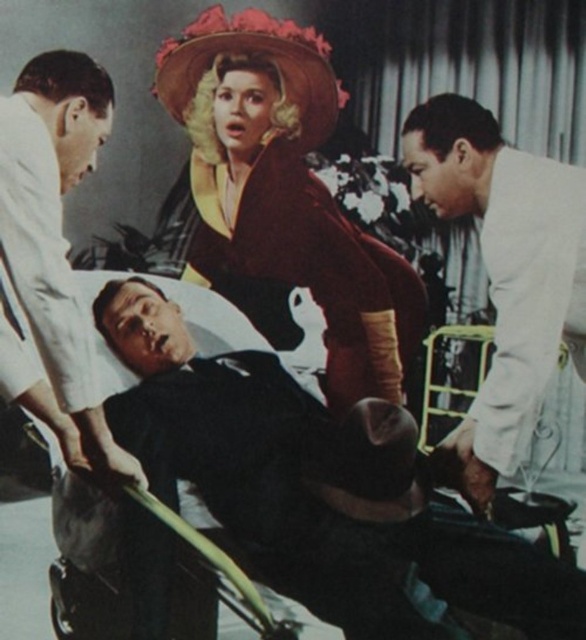
Question: Can you confirm if velvet maroon dress at center is positioned above white matte coat at right?

Choices:
 (A) no
 (B) yes

Answer: (B)

Question: Does velvet maroon dress at center have a smaller size compared to white matte coat at right?

Choices:
 (A) no
 (B) yes

Answer: (A)

Question: Observing the image, what is the correct spatial positioning of black matte suit at center in reference to white cloth coat at left?

Choices:
 (A) above
 (B) below

Answer: (B)

Question: Which object appears farthest from the camera in this image?

Choices:
 (A) white cloth coat at left
 (B) white matte coat at right

Answer: (B)

Question: Which object is closer to the camera taking this photo?

Choices:
 (A) white cloth coat at left
 (B) velvet maroon dress at center
 (C) black matte suit at center

Answer: (A)

Question: Which point is closer to the camera taking this photo?

Choices:
 (A) (524, 216)
 (B) (42, 273)
 (C) (322, 300)

Answer: (B)